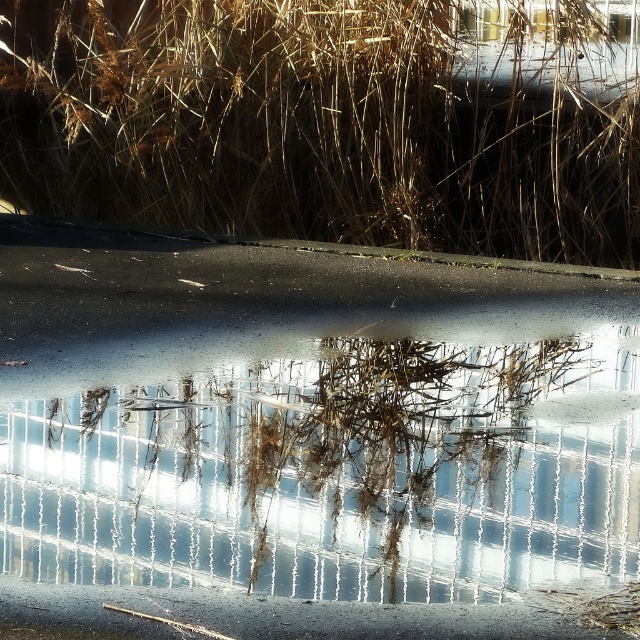
Between clear glass puddle at center and brown grass at upper center, which one appears on the left side from the viewer's perspective?

clear glass puddle at center

You are a GUI agent. You are given a task and a screenshot of the screen. Output one action in this format:
    pyautogui.click(x=<x>, y=<y>)
    Task: Click on the clear glass puddle at center
    
    Given the screenshot: What is the action you would take?
    pyautogui.click(x=342, y=467)

Where is `clear glass puddle at center`? clear glass puddle at center is located at coordinates (342, 467).